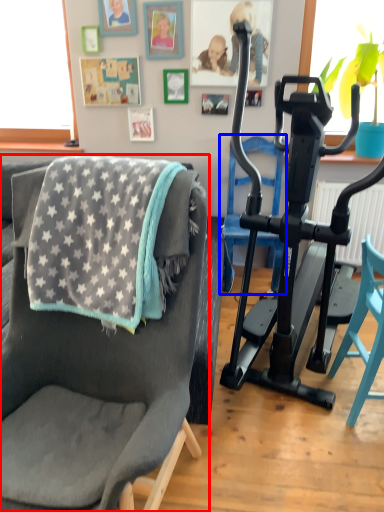
Question: Among these objects, which one is nearest to the camera, chair (highlighted by a red box) or armchair (highlighted by a blue box)?

Choices:
 (A) chair
 (B) armchair

Answer: (A)